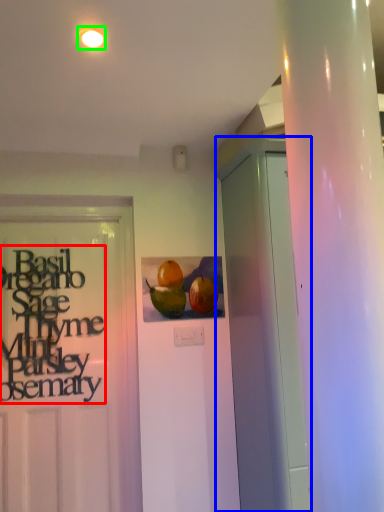
Question: Which object is positioned farthest from lettering (highlighted by a red box)? Select from garage door (highlighted by a blue box) and lighting (highlighted by a green box).

Choices:
 (A) garage door
 (B) lighting

Answer: (B)